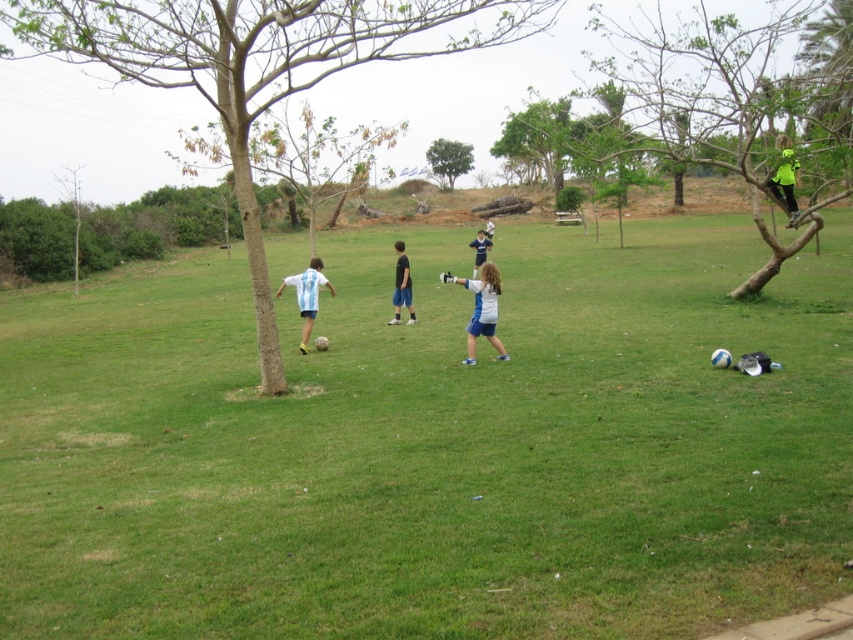
Question: Among these objects, which one is nearest to the camera?

Choices:
 (A) matte blue shorts at center
 (B) brown rough tree at center
 (C) white matte soccer ball at lower center

Answer: (B)

Question: Does green grassy field at center have a lesser width compared to brown rough tree at center?

Choices:
 (A) yes
 (B) no

Answer: (A)

Question: Which of the following is the closest to the observer?

Choices:
 (A) (51, 45)
 (B) (795, 184)
 (C) (424, 404)
 (D) (485, 228)

Answer: (C)

Question: Which point is closer to the camera?

Choices:
 (A) (776, 198)
 (B) (297, 298)
 (C) (171, 588)

Answer: (C)

Question: Is green grassy field at center thinner than green leafy tree at upper right?

Choices:
 (A) yes
 (B) no

Answer: (A)

Question: Is green leafy tree at upper center smaller than matte blue shorts at center?

Choices:
 (A) yes
 (B) no

Answer: (B)